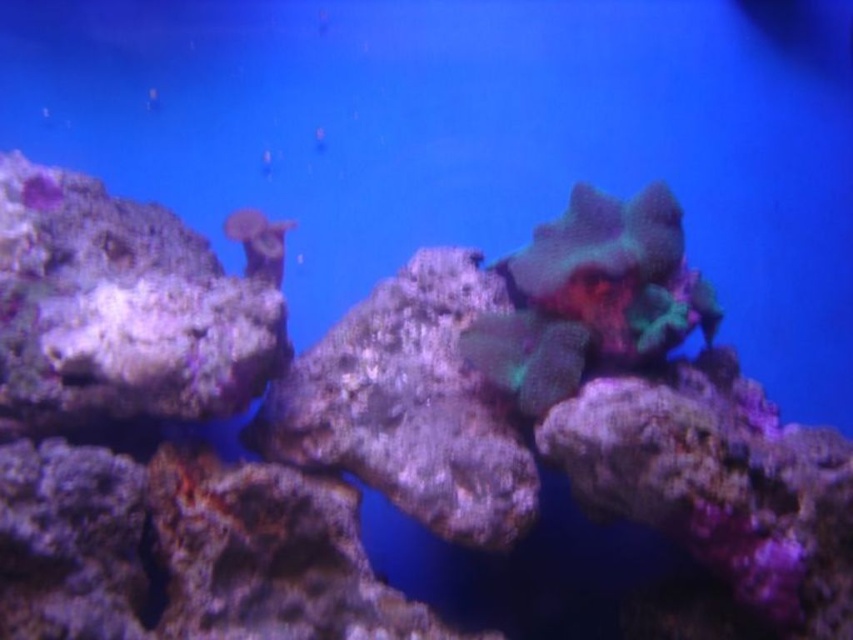
You are an underwater photographer aiming to capture a closeup of the green coral at center and the translucent coral at upper center. Since you want both corals in focus, which one should you adjust your camera focus on first?

The green coral at center is closer to the viewer than the translucent coral at upper center, so you should focus on the green coral at center first to ensure both are in focus.

You are a marine biologist studying the underwater environment of the aquarium. You notice a point marked at coordinates (409, 404). Based on the scene description, what type of object is located at this point?

The point at coordinates (409, 404) indicates a rough textured rock at center.